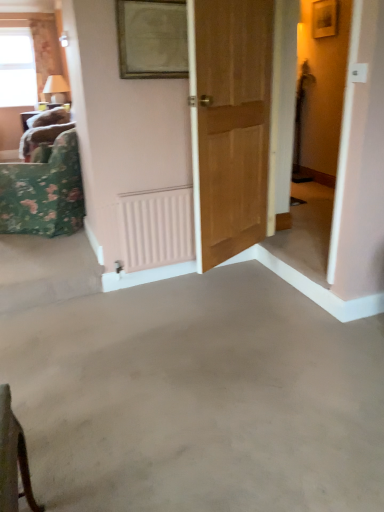
The image size is (384, 512). Describe the element at coordinates (44, 192) in the screenshot. I see `floral fabric cushion at left` at that location.

Measure the distance between wooden door at center and camera.

wooden door at center and camera are 2.07 meters apart.

Image resolution: width=384 pixels, height=512 pixels. I want to click on gray concrete floor at center, so click(x=199, y=398).

Find the location of a particular element. This screenshot has width=384, height=512. pink matte radiator at center is located at coordinates (156, 227).

At what (x,y) coordinates should I click in order to perform the action: click on floral fabric curtain at upper left. Please return your answer as a coordinate pair (x, y). This screenshot has height=512, width=384. Looking at the image, I should click on (45, 48).

Where is `floral fabric cushion at left`? The width and height of the screenshot is (384, 512). floral fabric cushion at left is located at coordinates (44, 192).

Does pink matte radiator at center have a lesser width compared to wooden door at center?

In fact, pink matte radiator at center might be wider than wooden door at center.

Is pink matte radiator at center far away from wooden door at center?

No.

Can you confirm if pink matte radiator at center is shorter than wooden door at center?

Correct, pink matte radiator at center is not as tall as wooden door at center.

Who is smaller, pink matte radiator at center or wooden door at center?

Smaller between the two is pink matte radiator at center.

Between gold-framed mirror at upper center and floral fabric cushion at left, which one is positioned in front?

gold-framed mirror at upper center.

Is gold-framed mirror at upper center inside the boundaries of floral fabric cushion at left, or outside?

gold-framed mirror at upper center exists outside the volume of floral fabric cushion at left.

How different are the orientations of gold-framed mirror at upper center and floral fabric cushion at left in degrees?

The angle between the facing direction of gold-framed mirror at upper center and the facing direction of floral fabric cushion at left is 128 degrees.

Is pink matte radiator at center spatially inside floral fabric cushion at left, or outside of it?

pink matte radiator at center is not inside floral fabric cushion at left, it's outside.

Considering the sizes of objects pink matte radiator at center and floral fabric cushion at left in the image provided, who is wider, pink matte radiator at center or floral fabric cushion at left?

Wider between the two is floral fabric cushion at left.

Does pink matte radiator at center appear on the left side of floral fabric cushion at left?

In fact, pink matte radiator at center is to the right of floral fabric cushion at left.

From the image's perspective, between pink matte radiator at center and floral fabric cushion at left, which one is located above?

floral fabric cushion at left.

Measure the distance between floral fabric cushion at left and gray concrete floor at center.

floral fabric cushion at left is 1.49 meters from gray concrete floor at center.

Which object is further away from the camera, floral fabric cushion at left or gray concrete floor at center?

floral fabric cushion at left is further away from the camera.

In the scene shown: Who is taller, floral fabric cushion at left or gray concrete floor at center?

floral fabric cushion at left is taller.

Is floral fabric cushion at left not close to gray concrete floor at center?

That's right, there is a large distance between floral fabric cushion at left and gray concrete floor at center.

In the image, there is a floral fabric cushion at left. At what (x,y) coordinates should I click in order to perform the action: click on concrete below it (from the image's perspective). Please return your answer as a coordinate pair (x, y). This screenshot has width=384, height=512. Looking at the image, I should click on (199, 398).

Is floral fabric cushion at left at the back of gray concrete floor at center?

No, gray concrete floor at center is not facing away from floral fabric cushion at left.

How different are the orientations of gray concrete floor at center and floral fabric cushion at left in degrees?

There is a 143-degree angle between the facing directions of gray concrete floor at center and floral fabric cushion at left.

Is gray concrete floor at center bigger or smaller than floral fabric cushion at left?

gray concrete floor at center is smaller than floral fabric cushion at left.

Between floral fabric cushion at left and pink matte radiator at center, which one has less height?

Standing shorter between the two is pink matte radiator at center.

The height and width of the screenshot is (512, 384). There is a pink matte radiator at center. Find the location of `furniture above it (from a real-world perspective)`. furniture above it (from a real-world perspective) is located at coordinates (44, 192).

Is point (73, 178) positioned before point (183, 210)?

No, it is behind (183, 210).

Is floral fabric cushion at left facing towards pink matte radiator at center?

No, floral fabric cushion at left is not aimed at pink matte radiator at center.

Is floral fabric curtain at upper left aimed at clear glass window at upper left?

No, floral fabric curtain at upper left is not facing towards clear glass window at upper left.

Which of these two, floral fabric curtain at upper left or clear glass window at upper left, is wider?

With larger width is floral fabric curtain at upper left.

Would you say floral fabric curtain at upper left is inside or outside clear glass window at upper left?

floral fabric curtain at upper left is not enclosed by clear glass window at upper left.

From a real-world perspective, is floral fabric curtain at upper left on clear glass window at upper left?

Indeed, from a real-world perspective, floral fabric curtain at upper left stands above clear glass window at upper left.

Where is `door lying on the right of pink matte radiator at center`? Image resolution: width=384 pixels, height=512 pixels. door lying on the right of pink matte radiator at center is located at coordinates (229, 123).

Locate an element on the screen. Image resolution: width=384 pixels, height=512 pixels. picture frame that is above the floral fabric cushion at left (from the image's perspective) is located at coordinates (152, 39).

Estimate the real-world distances between objects in this image. Which object is further from gold-framed mirror at upper center, floral fabric curtain at upper left or wooden door at center?

floral fabric curtain at upper left is positioned further to the anchor gold-framed mirror at upper center.

Estimate the real-world distances between objects in this image. Which object is further from floral fabric cushion at left, floral fabric curtain at upper left or clear glass window at upper left?

floral fabric curtain at upper left.

When comparing their distances from pink matte radiator at center, does gold-framed mirror at upper center or gray concrete floor at center seem closer?

Based on the image, gray concrete floor at center appears to be nearer to pink matte radiator at center.

Considering their positions, is clear glass window at upper left positioned closer to gold-framed mirror at upper center than pink matte radiator at center?

Among the two, pink matte radiator at center is located nearer to gold-framed mirror at upper center.

From the image, which object appears to be nearer to clear glass window at upper left, wooden door at center or floral fabric curtain at upper left?

floral fabric curtain at upper left is closer to clear glass window at upper left.

Based on their spatial positions, is pink matte radiator at center or wooden door at center closer to gold-framed mirror at upper center?

wooden door at center is closer to gold-framed mirror at upper center.

Based on their spatial positions, is wooden door at center or gray concrete floor at center further from pink matte radiator at center?

The object further to pink matte radiator at center is gray concrete floor at center.

When comparing their distances from floral fabric curtain at upper left, does gray concrete floor at center or floral fabric cushion at left seem further?

gray concrete floor at center.

Locate an element on the screen. The height and width of the screenshot is (512, 384). door between gold-framed mirror at upper center and gray concrete floor at center in the up-down direction is located at coordinates (229, 123).

You are a GUI agent. You are given a task and a screenshot of the screen. Output one action in this format:
    pyautogui.click(x=<x>, y=<y>)
    Task: Click on the furniture between gray concrete floor at center and floral fabric curtain at upper left from front to back
    This screenshot has height=512, width=384.
    Given the screenshot: What is the action you would take?
    pyautogui.click(x=44, y=192)

Image resolution: width=384 pixels, height=512 pixels. Identify the location of radiator between wooden door at center and clear glass window at upper left from front to back. (156, 227).

Find the location of a particular element. furniture between pink matte radiator at center and floral fabric curtain at upper left along the z-axis is located at coordinates (44, 192).